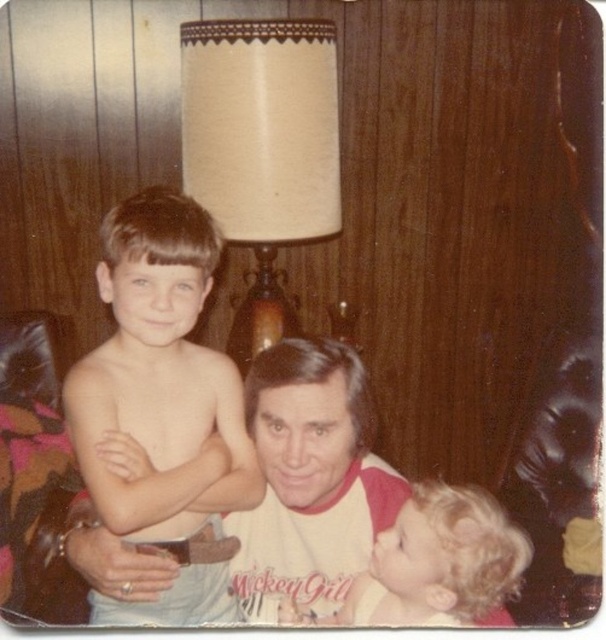
Does shiny blonde hair at center have a greater width compared to white/red raglan shirt at center?

Indeed, shiny blonde hair at center has a greater width compared to white/red raglan shirt at center.

Where is `shiny blonde hair at center`? The width and height of the screenshot is (606, 640). shiny blonde hair at center is located at coordinates (159, 381).

Does point (185, 468) come behind point (299, 371)?

That is True.

The image size is (606, 640). What are the coordinates of `shiny blonde hair at center` in the screenshot? It's located at (159, 381).

Measure the distance between point (x=164, y=472) and camera.

They are 3.74 feet apart.

Image resolution: width=606 pixels, height=640 pixels. I want to click on shiny blonde hair at center, so click(159, 381).

Who is more distant from viewer, (276, 129) or (384, 508)?

Point (276, 129)

Can you confirm if beige fabric lampshade at upper center is wider than white/red raglan shirt at center?

Yes, beige fabric lampshade at upper center is wider than white/red raglan shirt at center.

What do you see at coordinates (261, 148) in the screenshot? This screenshot has width=606, height=640. I see `beige fabric lampshade at upper center` at bounding box center [261, 148].

The image size is (606, 640). I want to click on beige fabric lampshade at upper center, so point(261,148).